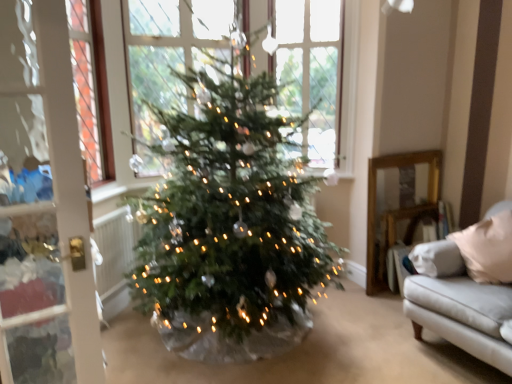
Question: Is clear glass window at upper center wider or thinner than white fabric couch at right?

Choices:
 (A) wide
 (B) thin

Answer: (A)

Question: Based on their positions, is clear glass window at upper center located to the left or right of white fabric couch at right?

Choices:
 (A) left
 (B) right

Answer: (A)

Question: Would you say clear glass window at upper center is inside or outside white fabric couch at right?

Choices:
 (A) inside
 (B) outside

Answer: (B)

Question: Considering the positions of white fabric couch at right and clear glass window at upper center in the image, is white fabric couch at right taller or shorter than clear glass window at upper center?

Choices:
 (A) tall
 (B) short

Answer: (B)

Question: Is white fabric couch at right bigger or smaller than clear glass window at upper center?

Choices:
 (A) big
 (B) small

Answer: (B)

Question: From a real-world perspective, is white fabric couch at right above or below clear glass window at upper center?

Choices:
 (A) below
 (B) above

Answer: (A)

Question: Looking at their shapes, would you say white fabric couch at right is wider or thinner than clear glass window at upper center?

Choices:
 (A) wide
 (B) thin

Answer: (B)